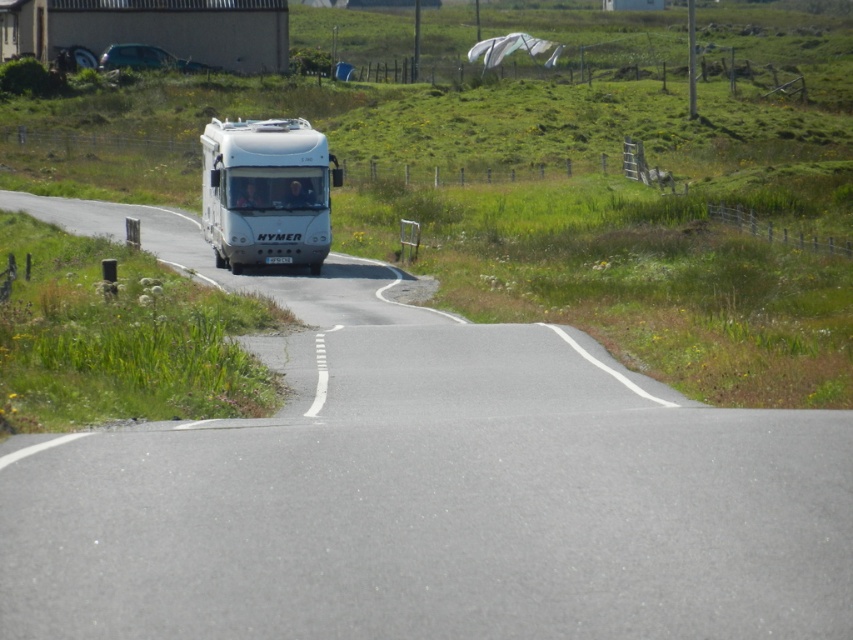
Looking at this image, you are a cyclist planning to overtake the white glossy bus at center on a road that is 33.33 meters long. Can you safely overtake the bus before the road curves to the left?

The distance between you and the white glossy bus at center is 33.33 meters, but since the road curves to the left ahead, it is not safe to overtake before the curve. Wait until the road straightens out for a safer maneuver.

You are driving a delivery van that is 6 meters long and want to pass between the white glossy bus at center and the metallic silver rv at upper left. The road is narrow, and you need to know if there is enough space. According to the scene description, can your van fit through the gap between them?

The gap between the white glossy bus at center and the metallic silver rv at upper left is 54.49 meters. Since your van is only 6 meters long, there is more than enough space for it to pass through the gap between them.

You are driving a white Hymer motorhome on a rural road. There is a point at coordinates point (219, 202) that you need to reach. If your motorhome is 10 meters long, can you safely stop before reaching that point without obstructing the road?

The point (219, 202) is 34.80 meters from the camera. Since the motorhome is 10 meters long, you can safely stop before reaching the point as there is sufficient distance to brake and stop without obstructing the road.